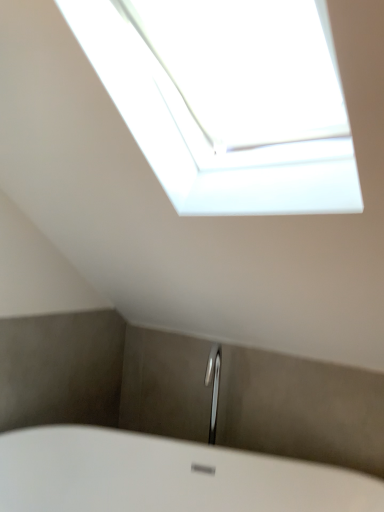
Describe the element at coordinates (202, 136) in the screenshot. I see `transparent glass window at upper center` at that location.

Locate an element on the screen. Image resolution: width=384 pixels, height=512 pixels. transparent glass window at upper center is located at coordinates (202, 136).

What do you see at coordinates (165, 476) in the screenshot? This screenshot has height=512, width=384. I see `white glossy bathtub at lower center` at bounding box center [165, 476].

At what (x,y) coordinates should I click in order to perform the action: click on white glossy bathtub at lower center. Please return your answer as a coordinate pair (x, y). Looking at the image, I should click on (165, 476).

Where is `transparent glass window at upper center`? The image size is (384, 512). transparent glass window at upper center is located at coordinates coord(202,136).

Does transparent glass window at upper center appear on the left side of white glossy bathtub at lower center?

A: In fact, transparent glass window at upper center is to the right of white glossy bathtub at lower center.

Looking at this image, between transparent glass window at upper center and white glossy bathtub at lower center, which one is positioned behind?

white glossy bathtub at lower center is behind.

Which is in front, point (98, 21) or point (259, 478)?

Point (98, 21)

From the image's perspective, who appears lower, transparent glass window at upper center or white glossy bathtub at lower center?

white glossy bathtub at lower center appears lower in the image.

Consider the image. From a real-world perspective, between transparent glass window at upper center and white glossy bathtub at lower center, who is vertically lower?

white glossy bathtub at lower center.

Between transparent glass window at upper center and white glossy bathtub at lower center, which one has smaller width?

Thinner between the two is white glossy bathtub at lower center.

Does transparent glass window at upper center have a lesser height compared to white glossy bathtub at lower center?

No, transparent glass window at upper center is not shorter than white glossy bathtub at lower center.

Considering the relative sizes of transparent glass window at upper center and white glossy bathtub at lower center in the image provided, is transparent glass window at upper center bigger than white glossy bathtub at lower center?

No.

Is transparent glass window at upper center completely or partially outside of white glossy bathtub at lower center?

Indeed, transparent glass window at upper center is completely outside white glossy bathtub at lower center.

Is transparent glass window at upper center with white glossy bathtub at lower center?

They are not placed beside each other.

Is transparent glass window at upper center oriented away from white glossy bathtub at lower center?

No, transparent glass window at upper center is not facing away from white glossy bathtub at lower center.

What's the angular difference between transparent glass window at upper center and white glossy bathtub at lower center's facing directions?

They differ by 20.5 degrees in their facing directions.

Measure the distance from transparent glass window at upper center to white glossy bathtub at lower center.

transparent glass window at upper center is 3.82 feet from white glossy bathtub at lower center.

This screenshot has height=512, width=384. Identify the location of bathtub behind the transparent glass window at upper center. (165, 476).

Looking at this image, is white glossy bathtub at lower center to the left or to the right of transparent glass window at upper center in the image?

Based on their positions, white glossy bathtub at lower center is located to the left of transparent glass window at upper center.

Which object is more forward, white glossy bathtub at lower center or transparent glass window at upper center?

Positioned in front is transparent glass window at upper center.

Does point (68, 445) come behind point (204, 143)?

Yes.

From the image's perspective, which is above, white glossy bathtub at lower center or transparent glass window at upper center?

transparent glass window at upper center, from the image's perspective.

From a real-world perspective, is white glossy bathtub at lower center on top of transparent glass window at upper center?

No, from a real-world perspective, white glossy bathtub at lower center is not above transparent glass window at upper center.

Is white glossy bathtub at lower center wider or thinner than transparent glass window at upper center?

In the image, white glossy bathtub at lower center appears to be more narrow than transparent glass window at upper center.

Looking at this image, can you confirm if white glossy bathtub at lower center is shorter than transparent glass window at upper center?

Correct, white glossy bathtub at lower center is not as tall as transparent glass window at upper center.

Considering the sizes of white glossy bathtub at lower center and transparent glass window at upper center in the image, is white glossy bathtub at lower center bigger or smaller than transparent glass window at upper center?

Considering their sizes, white glossy bathtub at lower center takes up more space than transparent glass window at upper center.

Is transparent glass window at upper center inside white glossy bathtub at lower center?

No.

Is white glossy bathtub at lower center not near transparent glass window at upper center?

Absolutely, white glossy bathtub at lower center is distant from transparent glass window at upper center.

Is white glossy bathtub at lower center oriented away from transparent glass window at upper center?

No, transparent glass window at upper center is not at the back of white glossy bathtub at lower center.

Locate an element on the screen. The width and height of the screenshot is (384, 512). bathtub lying on the left of transparent glass window at upper center is located at coordinates (165, 476).

Identify the location of window above the white glossy bathtub at lower center (from a real-world perspective). This screenshot has height=512, width=384. (202, 136).

In the image, there is a transparent glass window at upper center. Identify the location of bathtub below it (from a real-world perspective). The image size is (384, 512). (165, 476).